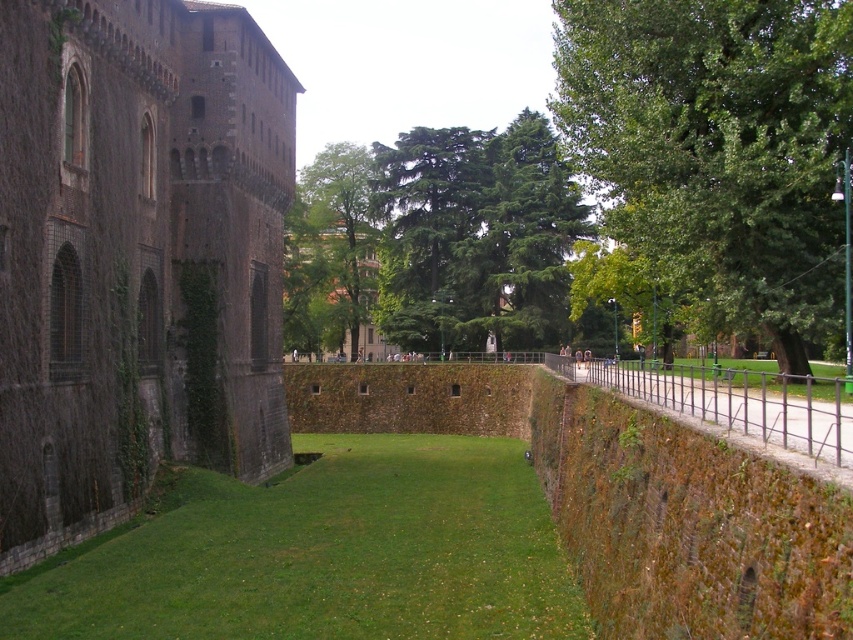
Based on the photo, which of these two, green leafy tree at right or green leafy tree at center, stands taller?

Standing taller between the two is green leafy tree at center.

Does green leafy tree at right appear on the right side of green leafy tree at center?

Correct, you'll find green leafy tree at right to the right of green leafy tree at center.

Locate an element on the screen. green leafy tree at right is located at coordinates (717, 148).

What do you see at coordinates (320, 554) in the screenshot? This screenshot has width=853, height=640. I see `green grass at center` at bounding box center [320, 554].

Can you confirm if green grass at center is bigger than green leafy tree at center?

Actually, green grass at center might be smaller than green leafy tree at center.

Between point (567, 586) and point (311, 193), which one is positioned in front?

Point (567, 586) is in front.

What are the coordinates of `green grass at center` in the screenshot? It's located at (320, 554).

Looking at this image, can you confirm if green leafy tree at right is smaller than green mossy stone wall at right?

No.

Which of these two, green leafy tree at right or green mossy stone wall at right, stands taller?

green leafy tree at right

Who is more distant from viewer, [804,104] or [625,612]?

The point [804,104] is behind.

I want to click on green leafy tree at right, so click(x=717, y=148).